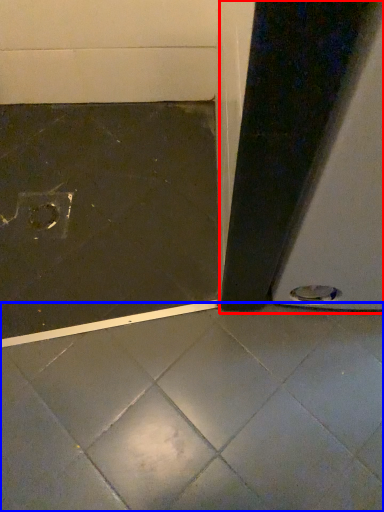
Question: Which of the following is the farthest to the observer, screen door (highlighted by a red box) or concrete (highlighted by a blue box)?

Choices:
 (A) screen door
 (B) concrete

Answer: (B)